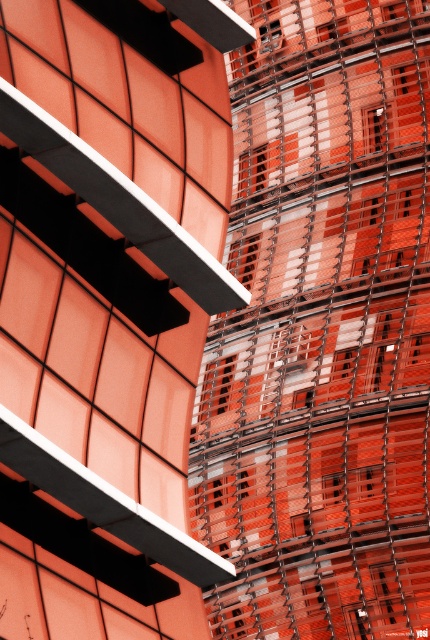
Question: Which object appears closest to the camera in this image?

Choices:
 (A) metallic grid at center
 (B) metallic grid tower at center

Answer: (B)

Question: Is metallic grid tower at center further to the viewer compared to metallic grid at center?

Choices:
 (A) no
 (B) yes

Answer: (A)

Question: Which of the following is the closest to the observer?

Choices:
 (A) metallic grid at center
 (B) metallic grid tower at center

Answer: (B)

Question: Does metallic grid tower at center appear on the left side of metallic grid at center?

Choices:
 (A) yes
 (B) no

Answer: (A)

Question: Is metallic grid tower at center above metallic grid at center?

Choices:
 (A) no
 (B) yes

Answer: (A)